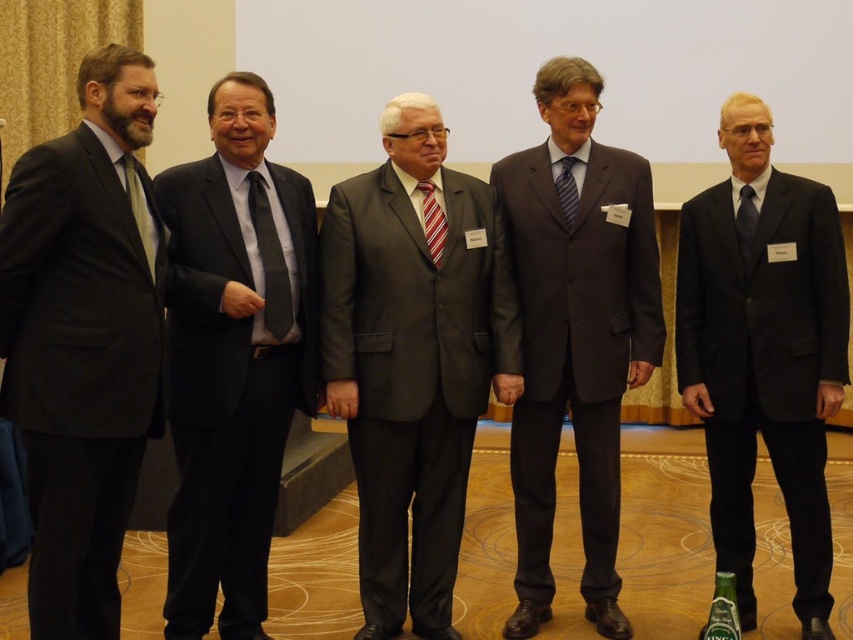
Question: Is black matte suit at right positioned before dark blue silk tie at center?

Choices:
 (A) no
 (B) yes

Answer: (B)

Question: Considering the real-world distances, which object is farthest from the matte black suit at center?

Choices:
 (A) striped fabric tie at center
 (B) blue striped tie at center
 (C) matte gray tie at center
 (D) matte black suit at left

Answer: (B)

Question: Which point is farther to the camera?

Choices:
 (A) matte gray suit at center
 (B) matte dark gray suit at center

Answer: (B)

Question: Is matte black suit at center above blue striped tie at center?

Choices:
 (A) yes
 (B) no

Answer: (B)

Question: Which point is closer to the camera taking this photo?

Choices:
 (A) coord(517,470)
 (B) coord(756,208)
 (C) coord(440,250)

Answer: (C)

Question: Considering the relative positions of matte gray suit at center and matte gray tie at center in the image provided, where is matte gray suit at center located with respect to matte gray tie at center?

Choices:
 (A) right
 (B) left

Answer: (A)